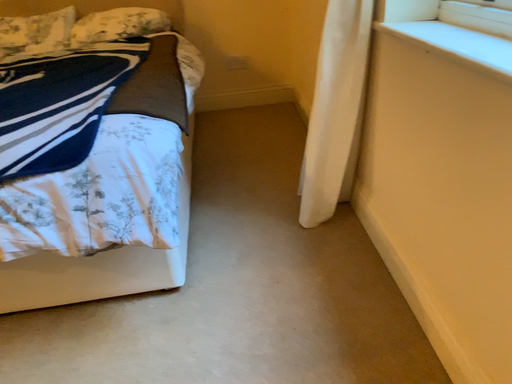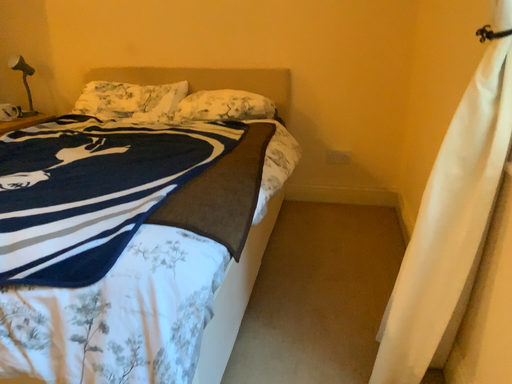
Question: How did the camera likely rotate when shooting the video?

Choices:
 (A) rotated right
 (B) rotated left

Answer: (B)